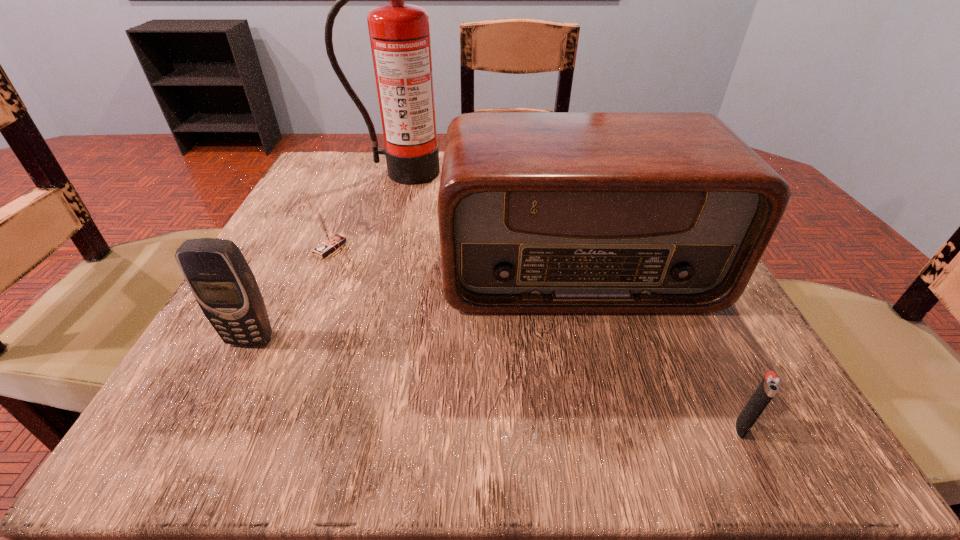
This screenshot has width=960, height=540. Find the location of `blank area located on the right of the matchbox`. blank area located on the right of the matchbox is located at coordinates (522, 248).

Locate an element on the screen. vacant space located on the left of the igniter is located at coordinates (413, 427).

The image size is (960, 540). In order to click on object that is at the far edge in this screenshot , I will do `click(399, 33)`.

In order to click on object located at the near edge in this screenshot , I will do point(770,384).

Locate an element on the screen. fire extinguisher that is at the left edge is located at coordinates (399, 33).

Where is `cellular telephone that is positioned at the left edge`? The image size is (960, 540). cellular telephone that is positioned at the left edge is located at coordinates (219, 277).

Locate an element on the screen. matchbox at the left edge is located at coordinates tap(330, 242).

You are a GUI agent. You are given a task and a screenshot of the screen. Output one action in this format:
    pyautogui.click(x=<x>, y=<y>)
    Task: Click on the radio receiver that is at the right edge
    The width and height of the screenshot is (960, 540).
    Given the screenshot: What is the action you would take?
    pyautogui.click(x=539, y=212)

Where is `igniter that is positioned at the right edge`? This screenshot has height=540, width=960. igniter that is positioned at the right edge is located at coordinates (770, 384).

The height and width of the screenshot is (540, 960). Identify the location of object located in the far left corner section of the desktop. (399, 33).